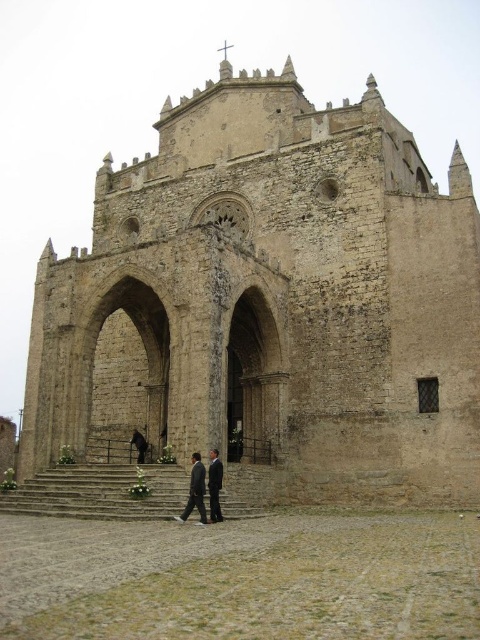
Question: Is dark gray suit at center positioned at the back of dark suit at center?

Choices:
 (A) no
 (B) yes

Answer: (B)

Question: Among these objects, which one is nearest to the camera?

Choices:
 (A) dark gray suit at center
 (B) stone steps at center

Answer: (A)

Question: Estimate the real-world distances between objects in this image. Which object is farther from the dark suit at center?

Choices:
 (A) dark gray suit at center
 (B) beige stone church at center
 (C) stone steps at center

Answer: (B)

Question: Can you confirm if beige stone church at center is bigger than dark gray suit at center?

Choices:
 (A) yes
 (B) no

Answer: (A)

Question: Is beige stone church at center behind dark gray suit at center?

Choices:
 (A) yes
 (B) no

Answer: (A)

Question: Among these points, which one is farthest from the camera?

Choices:
 (A) (22, 493)
 (B) (216, 461)

Answer: (A)